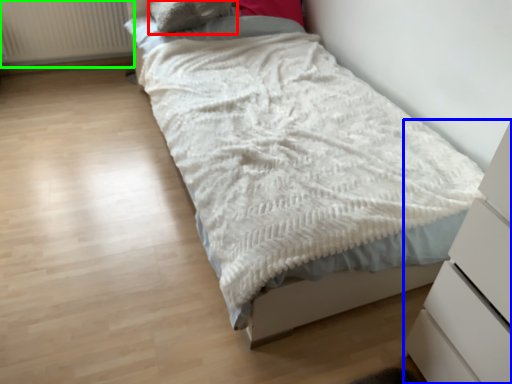
Question: Which object is positioned closest to pillow (highlighted by a red box)? Select from chest of drawers (highlighted by a blue box) and radiator (highlighted by a green box).

Choices:
 (A) chest of drawers
 (B) radiator

Answer: (B)